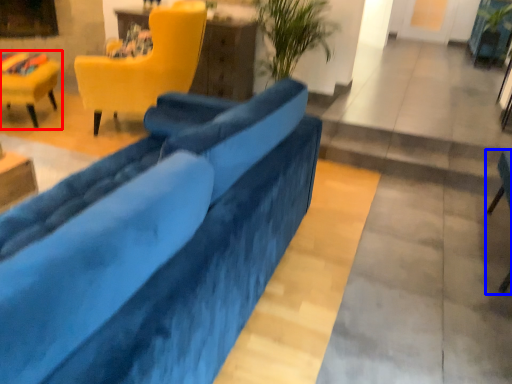
Question: Which of the following is the farthest to the observer, chair (highlighted by a red box) or chair (highlighted by a blue box)?

Choices:
 (A) chair
 (B) chair

Answer: (A)